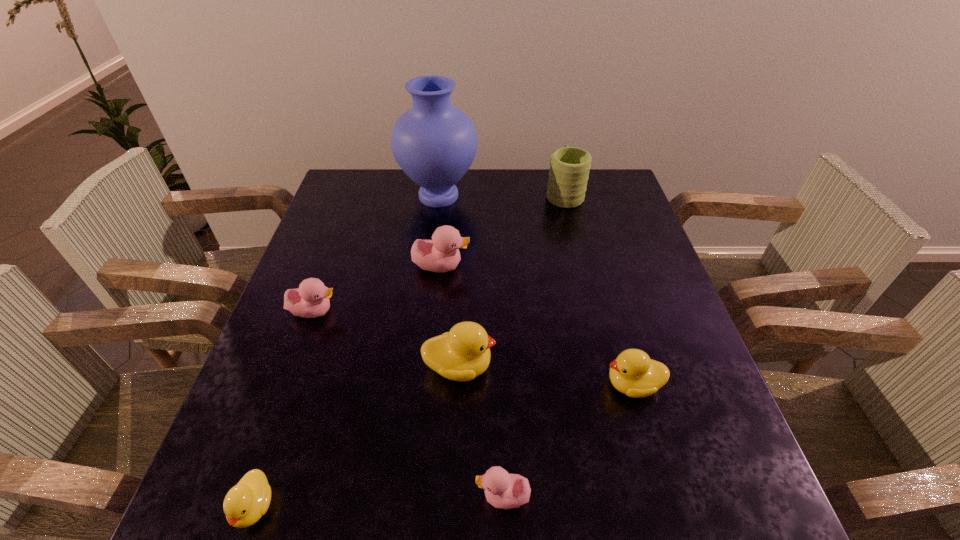
You are a GUI agent. You are given a task and a screenshot of the screen. Output one action in this format:
    pyautogui.click(x=<x>, y=<y>)
    Task: Click on the vacant space that's between the second pink duckling from right to left and the rightmost yellow duckling
    The width and height of the screenshot is (960, 540).
    Given the screenshot: What is the action you would take?
    pyautogui.click(x=537, y=325)

The image size is (960, 540). I want to click on free spot between the second smallest yellow duckling and the tallest object, so click(x=536, y=291).

This screenshot has height=540, width=960. In order to click on vacant area that lies between the biggest yellow duckling and the green mug in this screenshot , I will do `click(512, 280)`.

The image size is (960, 540). Find the location of `object that is the sixth nearest to the mug`. object that is the sixth nearest to the mug is located at coordinates (503, 490).

Identify the location of object that stands as the closest to the second yellow duckling from right to left. tap(503, 490).

You are a GUI agent. You are given a task and a screenshot of the screen. Output one action in this format:
    pyautogui.click(x=<x>, y=<y>)
    Task: Click on the fourth closest duckling to the second yellow duckling from right to left
    This screenshot has height=540, width=960.
    Given the screenshot: What is the action you would take?
    pyautogui.click(x=633, y=373)

Find the location of `duckling that is the fourth closest to the rightmost duckling`. duckling that is the fourth closest to the rightmost duckling is located at coordinates (311, 300).

Identify which pink duckling is the second closest to the nearest pink duckling. Please provide its 2D coordinates. Your answer should be formatted as a tuple, i.e. [(x, y)], where the tuple contains the x and y coordinates of a point satisfying the conditions above.

[(441, 254)]

At what (x,y) coordinates should I click in order to perform the action: click on pink duckling that is the second closest to the nearest pink duckling. Please return your answer as a coordinate pair (x, y). This screenshot has height=540, width=960. Looking at the image, I should click on (441, 254).

You are a GUI agent. You are given a task and a screenshot of the screen. Output one action in this format:
    pyautogui.click(x=<x>, y=<y>)
    Task: Click on the yellow duckling that stands as the closest to the rightmost pink duckling
    This screenshot has height=540, width=960.
    Given the screenshot: What is the action you would take?
    pyautogui.click(x=463, y=353)